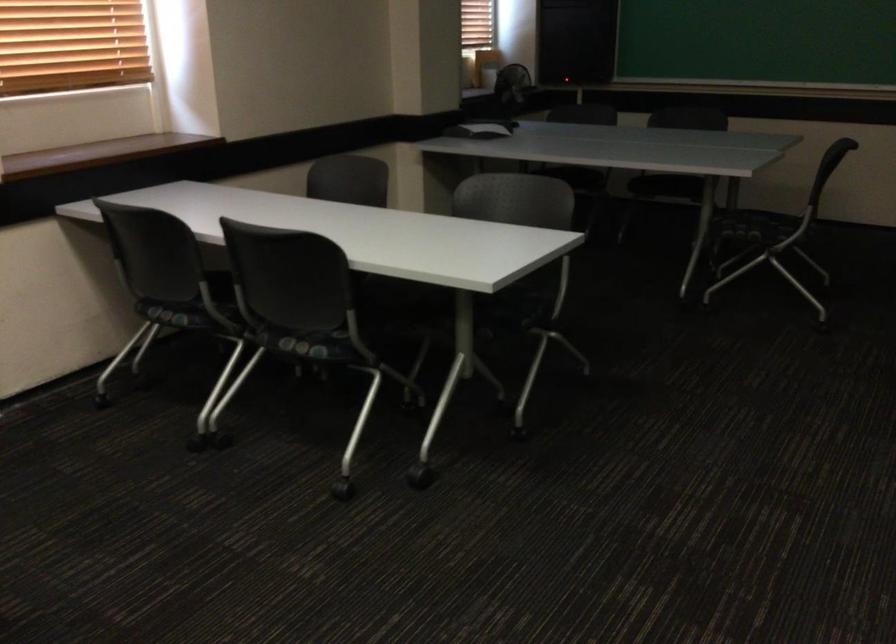
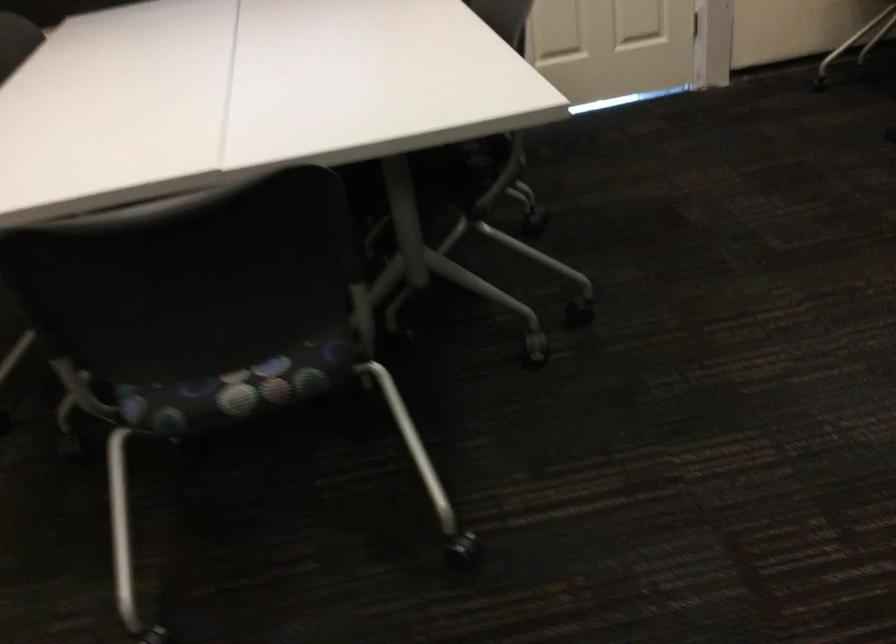
In the scene shown: The first image is from the beginning of the video and the second image is from the end. How did the camera likely rotate when shooting the video?

The rotation direction of the camera is left-down.